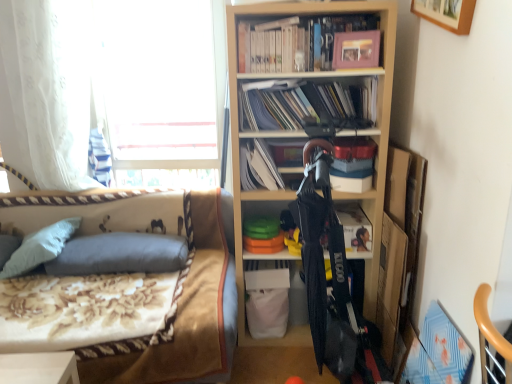
Question: Is white paper at center, which ranks as the 2th book in bottom-to-top order, beside wooden bookshelf at center?

Choices:
 (A) no
 (B) yes

Answer: (A)

Question: From a real-world perspective, does white paper at center, the third book in the top-to-bottom sequence, stand above wooden bookshelf at center?

Choices:
 (A) no
 (B) yes

Answer: (B)

Question: Is white paper at center, the third book in the top-to-bottom sequence, to the right of wooden bookshelf at center from the viewer's perspective?

Choices:
 (A) yes
 (B) no

Answer: (B)

Question: Considering the relative sizes of white paper at center, which ranks as the 2th book in bottom-to-top order, and wooden bookshelf at center in the image provided, is white paper at center, which ranks as the 2th book in bottom-to-top order, taller than wooden bookshelf at center?

Choices:
 (A) yes
 (B) no

Answer: (B)

Question: Could you tell me if white paper at center, which ranks as the 2th book in bottom-to-top order, is turned towards wooden bookshelf at center?

Choices:
 (A) yes
 (B) no

Answer: (A)

Question: Which is correct: white paper at center, the third book in the top-to-bottom sequence, is inside gray fabric pillow at left, which ranks as the 1th pillow in left-to-right order, or outside of it?

Choices:
 (A) outside
 (B) inside

Answer: (A)

Question: In the image, is white paper at center, the third book in the top-to-bottom sequence, positioned in front of or behind gray fabric pillow at left, which ranks as the 2th pillow in right-to-left order?

Choices:
 (A) front
 (B) behind

Answer: (A)

Question: Considering the positions of white paper at center, which ranks as the 2th book in bottom-to-top order, and gray fabric pillow at left, which ranks as the 1th pillow in left-to-right order, in the image, is white paper at center, which ranks as the 2th book in bottom-to-top order, wider or thinner than gray fabric pillow at left, which ranks as the 1th pillow in left-to-right order,?

Choices:
 (A) thin
 (B) wide

Answer: (A)

Question: From the image's perspective, is white paper at center, the third book in the top-to-bottom sequence, above or below gray fabric pillow at left, which ranks as the 2th pillow in right-to-left order?

Choices:
 (A) above
 (B) below

Answer: (A)

Question: From the image's perspective, relative to matte pink photo album at upper center, positioned as the 4th book in bottom-to-top order, is gray fabric pillow at left, the 1th pillow in the right-to-left sequence, above or below?

Choices:
 (A) below
 (B) above

Answer: (A)

Question: Would you say gray fabric pillow at left, the 2th pillow from the left, is to the left or to the right of matte pink photo album at upper center, positioned as the 4th book in bottom-to-top order, in the picture?

Choices:
 (A) right
 (B) left

Answer: (B)

Question: From a real-world perspective, is gray fabric pillow at left, the 1th pillow in the right-to-left sequence, positioned above or below matte pink photo album at upper center, marked as the first book in a top-to-bottom arrangement?

Choices:
 (A) below
 (B) above

Answer: (A)

Question: Does point (151, 235) appear closer or farther from the camera than point (246, 44)?

Choices:
 (A) farther
 (B) closer

Answer: (A)

Question: Considering the positions of white paper at center, the third book in the top-to-bottom sequence, and white sheer curtain at left in the image, is white paper at center, the third book in the top-to-bottom sequence, bigger or smaller than white sheer curtain at left?

Choices:
 (A) big
 (B) small

Answer: (B)

Question: From the image's perspective, relative to white sheer curtain at left, is white paper at center, which ranks as the 2th book in bottom-to-top order, above or below?

Choices:
 (A) below
 (B) above

Answer: (A)